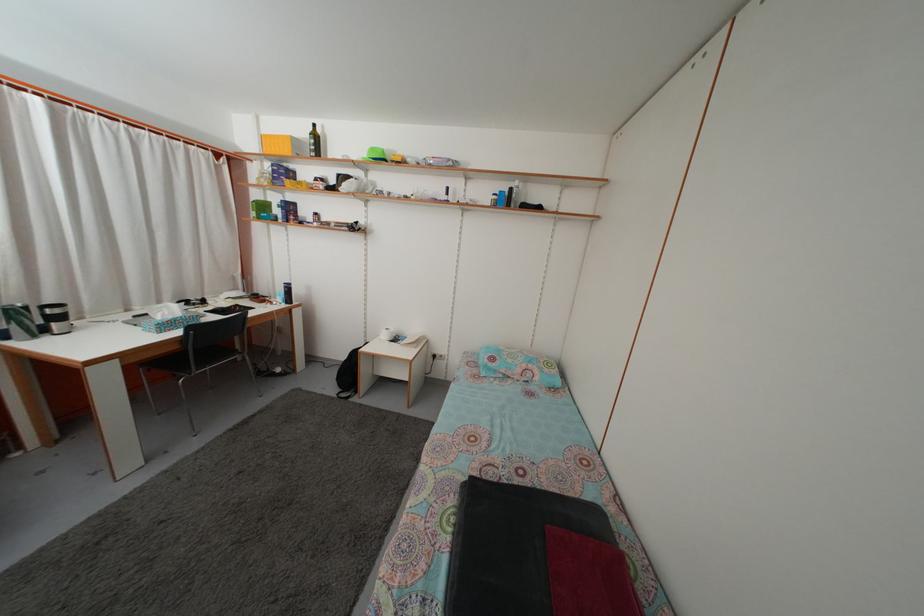
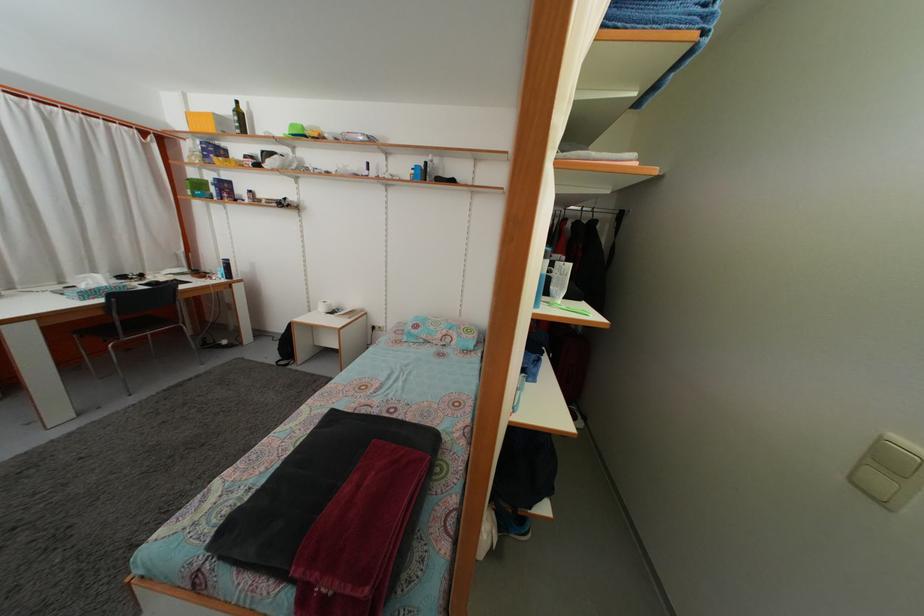
Where in the second image is the point corresponding to [379,156] from the first image?

(298, 132)